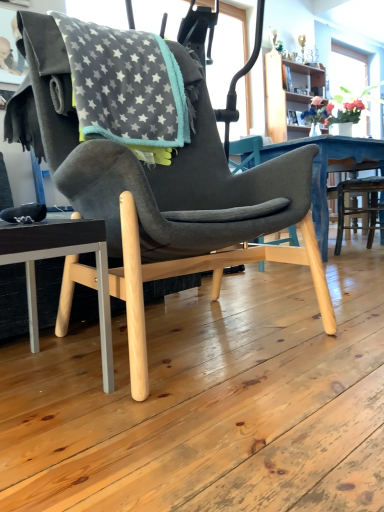
Question: Is matte black chair at lower left wider than gray fleece blanket at upper left?

Choices:
 (A) yes
 (B) no

Answer: (B)

Question: Can you confirm if matte black chair at lower left is bigger than gray fleece blanket at upper left?

Choices:
 (A) yes
 (B) no

Answer: (B)

Question: From the image's perspective, would you say matte black chair at lower left is positioned over gray fleece blanket at upper left?

Choices:
 (A) yes
 (B) no

Answer: (B)

Question: Considering the relative sizes of matte black chair at lower left and gray fleece blanket at upper left in the image provided, is matte black chair at lower left taller than gray fleece blanket at upper left?

Choices:
 (A) yes
 (B) no

Answer: (B)

Question: From the image's perspective, is matte black chair at lower left beneath gray fleece blanket at upper left?

Choices:
 (A) yes
 (B) no

Answer: (A)

Question: From a real-world perspective, is wooden bookshelf at upper right positioned above or below matte black chair at lower left?

Choices:
 (A) below
 (B) above

Answer: (B)

Question: Looking at the image, does wooden bookshelf at upper right seem bigger or smaller compared to matte black chair at lower left?

Choices:
 (A) big
 (B) small

Answer: (A)

Question: From the image's perspective, is wooden bookshelf at upper right above or below matte black chair at lower left?

Choices:
 (A) below
 (B) above

Answer: (B)

Question: Is wooden bookshelf at upper right taller or shorter than matte black chair at lower left?

Choices:
 (A) tall
 (B) short

Answer: (A)

Question: In terms of width, does wooden bookshelf at upper right look wider or thinner when compared to gray fleece blanket at upper left?

Choices:
 (A) thin
 (B) wide

Answer: (A)

Question: Is wooden bookshelf at upper right in front of or behind gray fleece blanket at upper left in the image?

Choices:
 (A) front
 (B) behind

Answer: (B)

Question: Does point (269, 56) appear closer or farther from the camera than point (84, 38)?

Choices:
 (A) closer
 (B) farther

Answer: (B)

Question: In terms of height, does wooden bookshelf at upper right look taller or shorter compared to gray fleece blanket at upper left?

Choices:
 (A) short
 (B) tall

Answer: (B)

Question: Choose the correct answer: Is matte black chair at lower left inside gray fleece blanket at upper left or outside it?

Choices:
 (A) inside
 (B) outside

Answer: (B)

Question: From the image's perspective, is matte black chair at lower left above or below gray fleece blanket at upper left?

Choices:
 (A) above
 (B) below

Answer: (B)